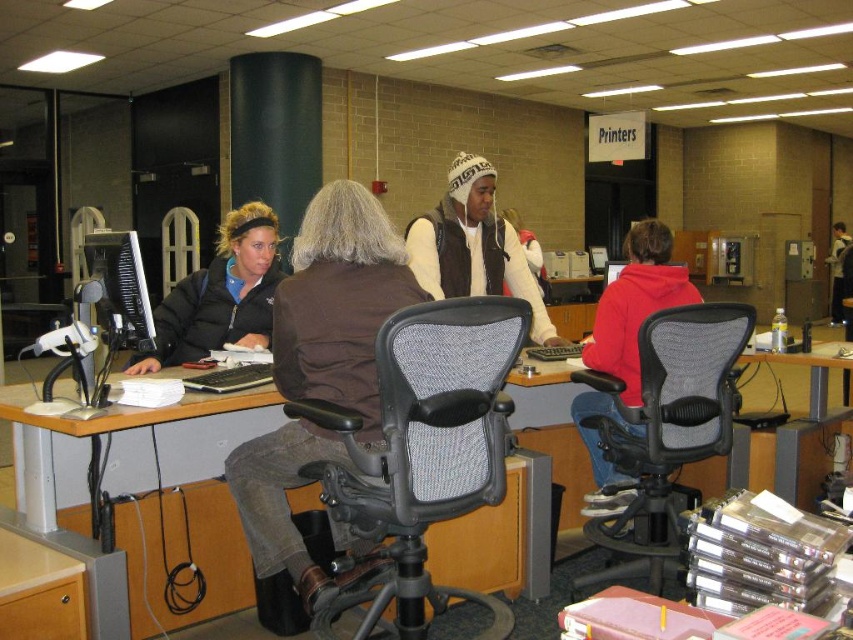
Question: Considering the relative positions of wooden desk at center and black mesh swivel chair at center in the image provided, where is wooden desk at center located with respect to black mesh swivel chair at center?

Choices:
 (A) left
 (B) right

Answer: (A)

Question: Which point appears closest to the camera in this image?

Choices:
 (A) (663, 284)
 (B) (107, 624)
 (C) (625, 540)
 (D) (500, 342)

Answer: (B)

Question: Which point is closer to the camera?

Choices:
 (A) (80, 508)
 (B) (445, 472)
 (C) (579, 394)

Answer: (B)

Question: Considering the real-world distances, which object is closest to the matte gray desk at center?

Choices:
 (A) red fleece hoodie at center
 (B) gray mesh swivel chair at center
 (C) black mesh swivel chair at center

Answer: (B)

Question: Does matte gray desk at center have a lesser width compared to red fleece hoodie at center?

Choices:
 (A) no
 (B) yes

Answer: (A)

Question: Does wooden desk at center have a larger size compared to red fleece hoodie at center?

Choices:
 (A) yes
 (B) no

Answer: (B)